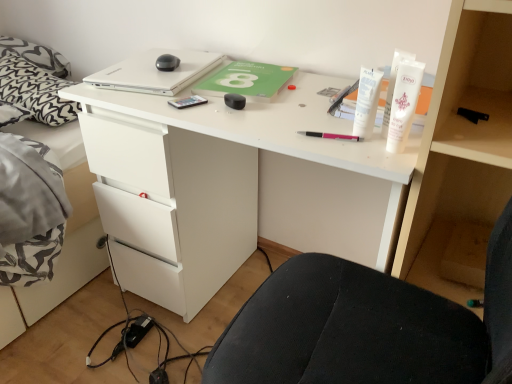
Identify the location of vacant region in front of black rubberized mouse at center, the 2th stationery in the left-to-right sequence. (245, 122).